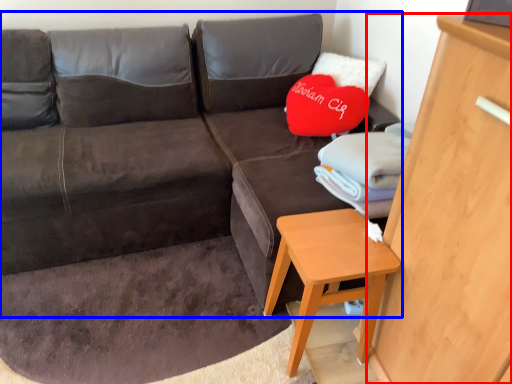
Question: Which of the following is the farthest to the observer, dresser (highlighted by a red box) or studio couch (highlighted by a blue box)?

Choices:
 (A) dresser
 (B) studio couch

Answer: (B)